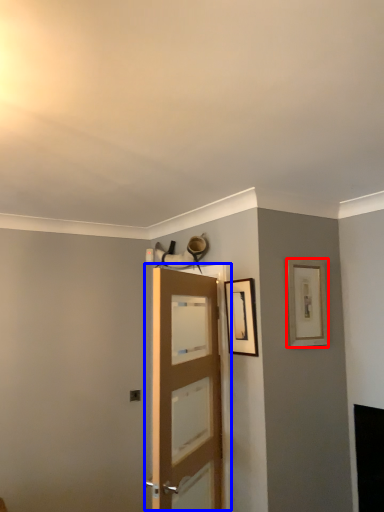
Question: Which object is further to the camera taking this photo, picture frame (highlighted by a red box) or door (highlighted by a blue box)?

Choices:
 (A) picture frame
 (B) door

Answer: (A)